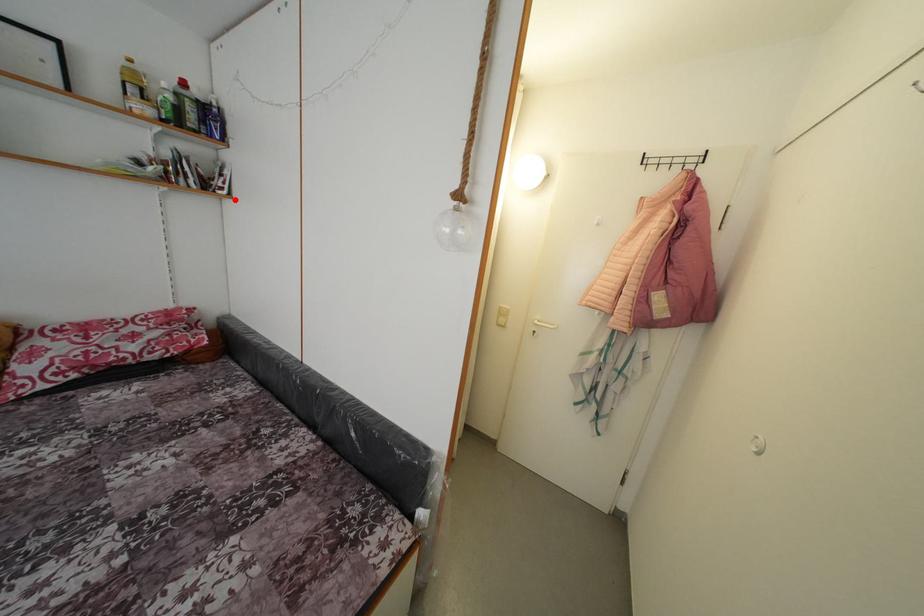
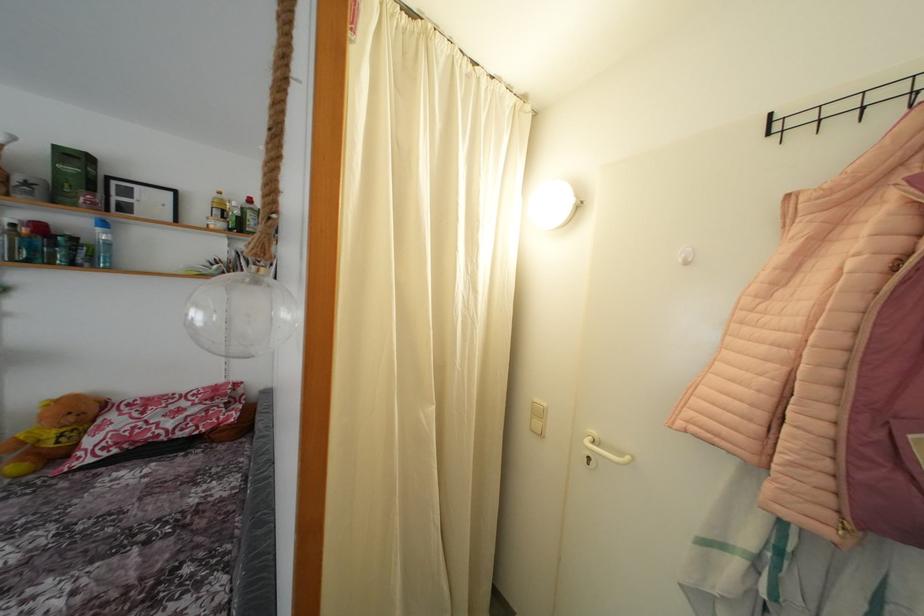
Question: I am providing you with two images of the same scene from different viewpoints. A red point is marked on the first image. At the location where the point appears in image 1, is it still visible in image 2?

Choices:
 (A) Yes
 (B) No

Answer: (A)